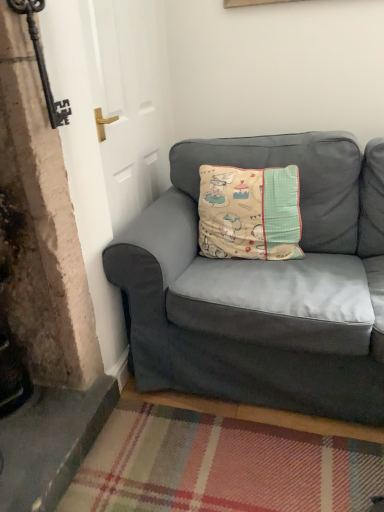
Question: Is beige fabric cushion at center in front of or behind suede gray couch at lower right in the image?

Choices:
 (A) behind
 (B) front

Answer: (A)

Question: Considering the relative positions of beige fabric cushion at center and suede gray couch at lower right in the image provided, is beige fabric cushion at center to the left or to the right of suede gray couch at lower right?

Choices:
 (A) right
 (B) left

Answer: (B)

Question: Does point (279, 220) appear closer or farther from the camera than point (321, 237)?

Choices:
 (A) farther
 (B) closer

Answer: (B)

Question: Would you say suede gray couch at lower right is inside or outside beige fabric cushion at center?

Choices:
 (A) inside
 (B) outside

Answer: (B)

Question: From the image's perspective, relative to beige fabric cushion at center, is suede gray couch at lower right above or below?

Choices:
 (A) below
 (B) above

Answer: (A)

Question: Based on their positions, is suede gray couch at lower right located to the left or right of beige fabric cushion at center?

Choices:
 (A) left
 (B) right

Answer: (B)

Question: Considering the positions of point (158, 322) and point (271, 228), is point (158, 322) closer or farther from the camera than point (271, 228)?

Choices:
 (A) closer
 (B) farther

Answer: (A)